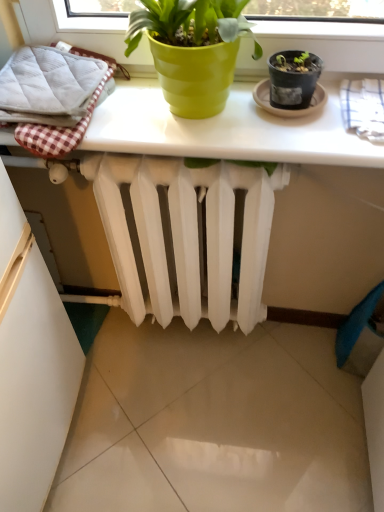
Describe the element at coordinates (363, 106) in the screenshot. I see `white checkered bath towel at upper right, positioned as the first bath towel in right-to-left order` at that location.

The width and height of the screenshot is (384, 512). What are the coordinates of `white matte radiator at center` in the screenshot? It's located at point(184,236).

This screenshot has height=512, width=384. What do you see at coordinates (225, 130) in the screenshot?
I see `white glossy table at upper center` at bounding box center [225, 130].

Measure the distance between point [69,116] and camera.

Point [69,116] is 29.21 inches away from camera.

Where is `white checkered bath towel at upper right, positioned as the second bath towel in left-to-right order`? white checkered bath towel at upper right, positioned as the second bath towel in left-to-right order is located at coordinates 363,106.

Which object is thinner, white glossy table at upper center or white matte radiator at center?

With smaller width is white matte radiator at center.

Based on the photo, considering the sizes of objects white glossy table at upper center and white matte radiator at center in the image provided, who is smaller, white glossy table at upper center or white matte radiator at center?

white glossy table at upper center is smaller.

Is white glossy table at upper center with white matte radiator at center?

No, white glossy table at upper center is not making contact with white matte radiator at center.

Which point is more forward, (146,118) or (153,237)?

The point (146,118) is closer.

Does white matte radiator at center have a smaller size compared to white glossy table at upper center?

Incorrect, white matte radiator at center is not smaller in size than white glossy table at upper center.

Is white matte radiator at center in front of white glossy table at upper center?

No, it is not.

Is white matte radiator at center wider or thinner than white glossy table at upper center?

Considering their sizes, white matte radiator at center looks slimmer than white glossy table at upper center.

Locate an element on the screen. The image size is (384, 512). radiator located below the white quilted bath towel at left, acting as the 1th bath towel starting from the left (from the image's perspective) is located at coordinates (184, 236).

Can you confirm if white quilted bath towel at left, the second bath towel viewed from the right, is smaller than white matte radiator at center?

Indeed, white quilted bath towel at left, the second bath towel viewed from the right, has a smaller size compared to white matte radiator at center.

Between white quilted bath towel at left, acting as the 1th bath towel starting from the left, and white matte radiator at center, which one is positioned in front?

Positioned in front is white quilted bath towel at left, acting as the 1th bath towel starting from the left.

From the image's perspective, which is below, white quilted bath towel at left, the second bath towel viewed from the right, or white matte radiator at center?

white matte radiator at center is shown below in the image.

Who is more distant, white quilted bath towel at left, the second bath towel viewed from the right, or white checkered bath towel at upper right, positioned as the second bath towel in left-to-right order?

white quilted bath towel at left, the second bath towel viewed from the right, is behind.

Is white quilted bath towel at left, the second bath towel viewed from the right, inside or outside of white checkered bath towel at upper right, positioned as the second bath towel in left-to-right order?

white quilted bath towel at left, the second bath towel viewed from the right, is not inside white checkered bath towel at upper right, positioned as the second bath towel in left-to-right order, it's outside.

Is white quilted bath towel at left, acting as the 1th bath towel starting from the left, far from white checkered bath towel at upper right, positioned as the first bath towel in right-to-left order?

No, white quilted bath towel at left, acting as the 1th bath towel starting from the left, is not far from white checkered bath towel at upper right, positioned as the first bath towel in right-to-left order.

From a real-world perspective, which is physically below, white quilted bath towel at left, acting as the 1th bath towel starting from the left, or white checkered bath towel at upper right, positioned as the second bath towel in left-to-right order?

white checkered bath towel at upper right, positioned as the second bath towel in left-to-right order, is physically lower.

What's the angular difference between white checkered bath towel at upper right, positioned as the first bath towel in right-to-left order, and white glossy table at upper center's facing directions?

The angular difference between white checkered bath towel at upper right, positioned as the first bath towel in right-to-left order, and white glossy table at upper center is 0.000616 degrees.

The image size is (384, 512). Identify the location of table to the left of white checkered bath towel at upper right, positioned as the second bath towel in left-to-right order. (225, 130).

The width and height of the screenshot is (384, 512). What are the coordinates of `table located in front of the white quilted bath towel at left, the second bath towel viewed from the right` in the screenshot? It's located at (225, 130).

Which of these two, white glossy table at upper center or white quilted bath towel at left, acting as the 1th bath towel starting from the left, stands shorter?

white glossy table at upper center is shorter.

Considering the relative positions of white glossy table at upper center and white quilted bath towel at left, acting as the 1th bath towel starting from the left, in the image provided, is white glossy table at upper center to the left of white quilted bath towel at left, acting as the 1th bath towel starting from the left, from the viewer's perspective?

No, white glossy table at upper center is not to the left of white quilted bath towel at left, acting as the 1th bath towel starting from the left.

From a real-world perspective, is white glossy table at upper center located higher than white quilted bath towel at left, the second bath towel viewed from the right?

Incorrect, from a real-world perspective, white glossy table at upper center is lower than white quilted bath towel at left, the second bath towel viewed from the right.

Can you confirm if white checkered bath towel at upper right, positioned as the second bath towel in left-to-right order, is bigger than white matte radiator at center?

Actually, white checkered bath towel at upper right, positioned as the second bath towel in left-to-right order, might be smaller than white matte radiator at center.

Can you confirm if white checkered bath towel at upper right, positioned as the first bath towel in right-to-left order, is shorter than white matte radiator at center?

Indeed, white checkered bath towel at upper right, positioned as the first bath towel in right-to-left order, has a lesser height compared to white matte radiator at center.

Considering the sizes of objects white checkered bath towel at upper right, positioned as the second bath towel in left-to-right order, and white matte radiator at center in the image provided, who is thinner, white checkered bath towel at upper right, positioned as the second bath towel in left-to-right order, or white matte radiator at center?

Thinner between the two is white matte radiator at center.

Is white matte radiator at center completely or partially inside white checkered bath towel at upper right, positioned as the first bath towel in right-to-left order?

Actually, white matte radiator at center is outside white checkered bath towel at upper right, positioned as the first bath towel in right-to-left order.

This screenshot has height=512, width=384. Find the location of `radiator behind the white glossy table at upper center`. radiator behind the white glossy table at upper center is located at coordinates (184, 236).

I want to click on table above the white matte radiator at center (from a real-world perspective), so click(225, 130).

Which object lies further to the anchor point white glossy table at upper center, white quilted bath towel at left, the second bath towel viewed from the right, or white checkered bath towel at upper right, positioned as the second bath towel in left-to-right order?

white checkered bath towel at upper right, positioned as the second bath towel in left-to-right order.

When comparing their distances from white checkered bath towel at upper right, positioned as the first bath towel in right-to-left order, does white matte radiator at center or white glossy table at upper center seem closer?

The object closer to white checkered bath towel at upper right, positioned as the first bath towel in right-to-left order, is white glossy table at upper center.

Which object lies nearer to the anchor point white glossy table at upper center, white quilted bath towel at left, acting as the 1th bath towel starting from the left, or white matte radiator at center?

Among the two, white quilted bath towel at left, acting as the 1th bath towel starting from the left, is located nearer to white glossy table at upper center.

Looking at the image, which one is located further to white matte radiator at center, white checkered bath towel at upper right, positioned as the first bath towel in right-to-left order, or white glossy table at upper center?

white checkered bath towel at upper right, positioned as the first bath towel in right-to-left order.

Considering their positions, is white checkered bath towel at upper right, positioned as the second bath towel in left-to-right order, positioned closer to white quilted bath towel at left, acting as the 1th bath towel starting from the left, than white matte radiator at center?

white matte radiator at center lies closer to white quilted bath towel at left, acting as the 1th bath towel starting from the left, than the other object.

Based on the photo, looking at the image, which one is located closer to white matte radiator at center, white glossy table at upper center or white quilted bath towel at left, the second bath towel viewed from the right?

white glossy table at upper center lies closer to white matte radiator at center than the other object.

Considering their positions, is white matte radiator at center positioned further to white glossy table at upper center than white checkered bath towel at upper right, positioned as the first bath towel in right-to-left order?

Among the two, white matte radiator at center is located further to white glossy table at upper center.

Based on their spatial positions, is white quilted bath towel at left, acting as the 1th bath towel starting from the left, or white matte radiator at center closer to white checkered bath towel at upper right, positioned as the second bath towel in left-to-right order?

white matte radiator at center lies closer to white checkered bath towel at upper right, positioned as the second bath towel in left-to-right order, than the other object.

At what (x,y) coordinates should I click in order to perform the action: click on radiator between white quilted bath towel at left, acting as the 1th bath towel starting from the left, and white checkered bath towel at upper right, positioned as the first bath towel in right-to-left order, in the horizontal direction. Please return your answer as a coordinate pair (x, y). This screenshot has width=384, height=512. Looking at the image, I should click on (184, 236).

At what (x,y) coordinates should I click in order to perform the action: click on table between white quilted bath towel at left, acting as the 1th bath towel starting from the left, and white checkered bath towel at upper right, positioned as the second bath towel in left-to-right order, from left to right. Please return your answer as a coordinate pair (x, y). Looking at the image, I should click on tap(225, 130).

This screenshot has width=384, height=512. In order to click on table between white quilted bath towel at left, acting as the 1th bath towel starting from the left, and white matte radiator at center vertically in this screenshot , I will do `click(225, 130)`.

Locate an element on the screen. Image resolution: width=384 pixels, height=512 pixels. table located between white matte radiator at center and white checkered bath towel at upper right, positioned as the second bath towel in left-to-right order, in the left-right direction is located at coordinates coord(225,130).